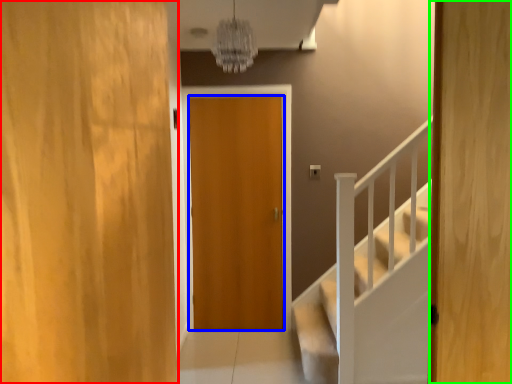
Question: Which object is the farthest from door (highlighted by a red box)? Choose among these: door (highlighted by a blue box) or door (highlighted by a green box).

Choices:
 (A) door
 (B) door

Answer: (A)